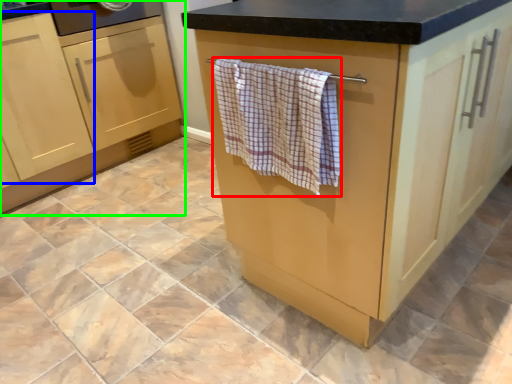
Question: Estimate the real-world distances between objects in this image. Which object is farther from bath towel (highlighted by a red box), cabinetry (highlighted by a blue box) or cabinetry (highlighted by a green box)?

Choices:
 (A) cabinetry
 (B) cabinetry

Answer: (B)